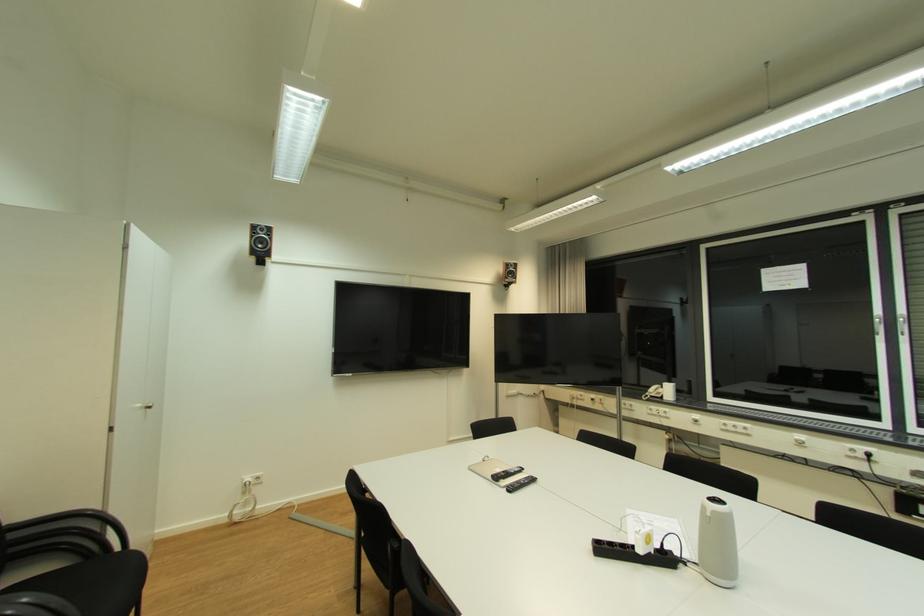
Where would you pull the silver cabinet handle? Please return your answer as a coordinate pair (x, y).

(143, 406)